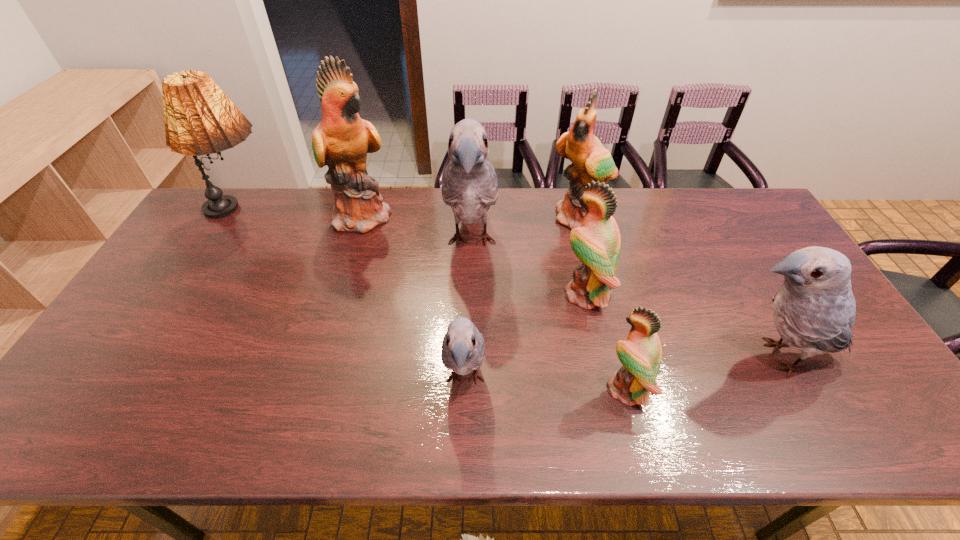
You are a GUI agent. You are given a task and a screenshot of the screen. Output one action in this format:
    pyautogui.click(x=<x>, y=<y>)
    Task: Click on the free space located 0.210m on the front-facing side of the nearest green parrot
    The width and height of the screenshot is (960, 540).
    Given the screenshot: What is the action you would take?
    pyautogui.click(x=516, y=389)

The image size is (960, 540). Identify the location of free point located on the front-facing side of the nearest green parrot. (541, 389).

Locate an element on the screen. The width and height of the screenshot is (960, 540). vacant area situated on the front-facing side of the nearest green parrot is located at coordinates (457, 389).

This screenshot has height=540, width=960. I want to click on lampshade situated at the far edge, so click(200, 119).

Locate an element on the screen. The height and width of the screenshot is (540, 960). object present at the left edge is located at coordinates (200, 119).

The height and width of the screenshot is (540, 960). I want to click on object that is at the right edge, so click(814, 310).

The height and width of the screenshot is (540, 960). In order to click on object present at the far left corner in this screenshot , I will do `click(200, 119)`.

Identify the location of free space at the far edge. (654, 221).

The image size is (960, 540). Identify the location of vacant region at the near edge. (777, 422).

Identify the location of free space at the left edge. (209, 267).